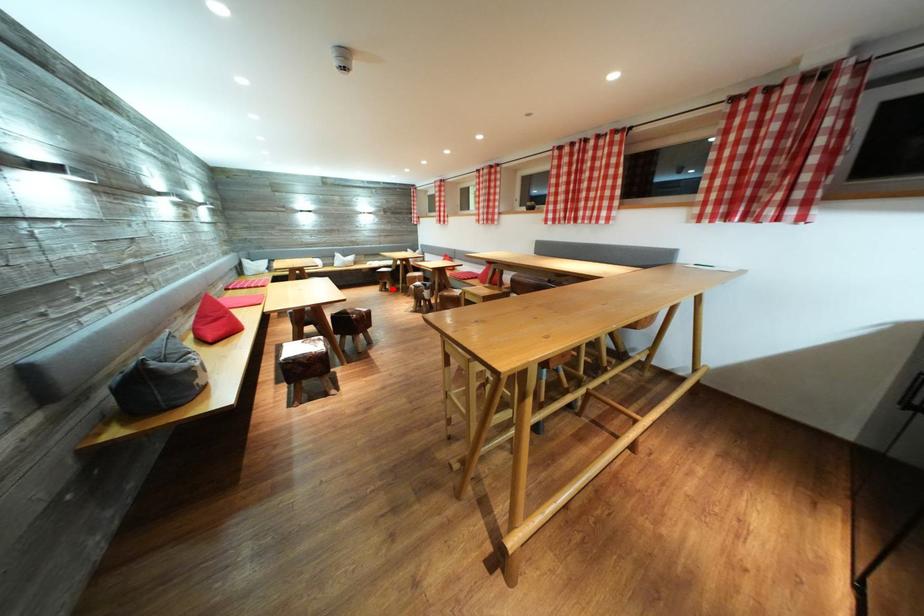
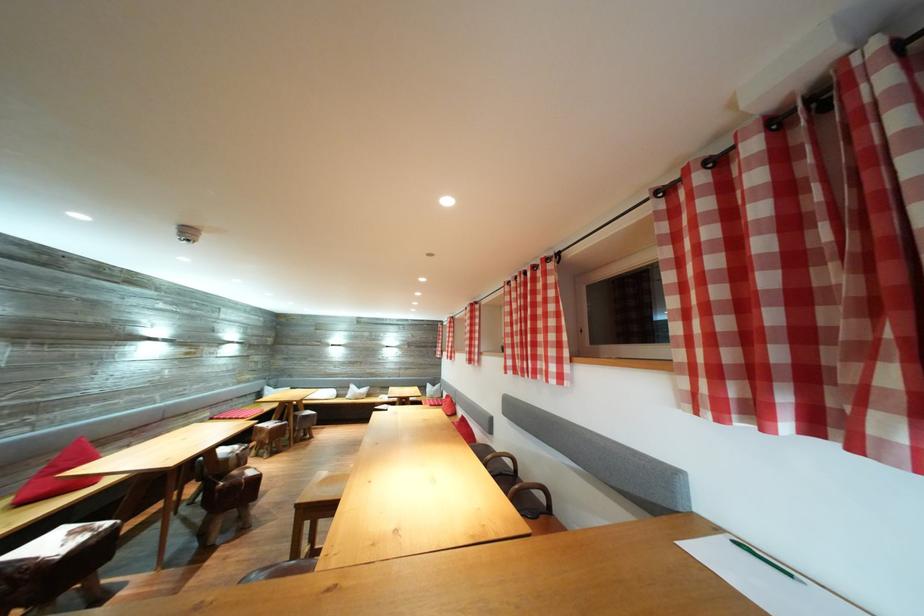
Question: I am providing you with two images of the same scene from different viewpoints. A red point is marked on the first image. Is the red point's position out of view in image 2?

Choices:
 (A) Yes
 (B) No

Answer: (A)